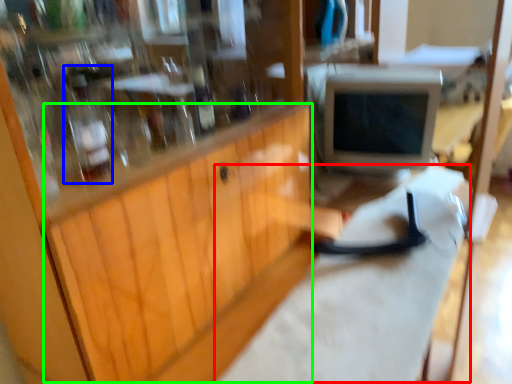
Question: Based on their relative distances, which object is farther from workbench (highlighted by a red box)? Choose from bottle (highlighted by a blue box) and wood (highlighted by a green box).

Choices:
 (A) bottle
 (B) wood

Answer: (A)